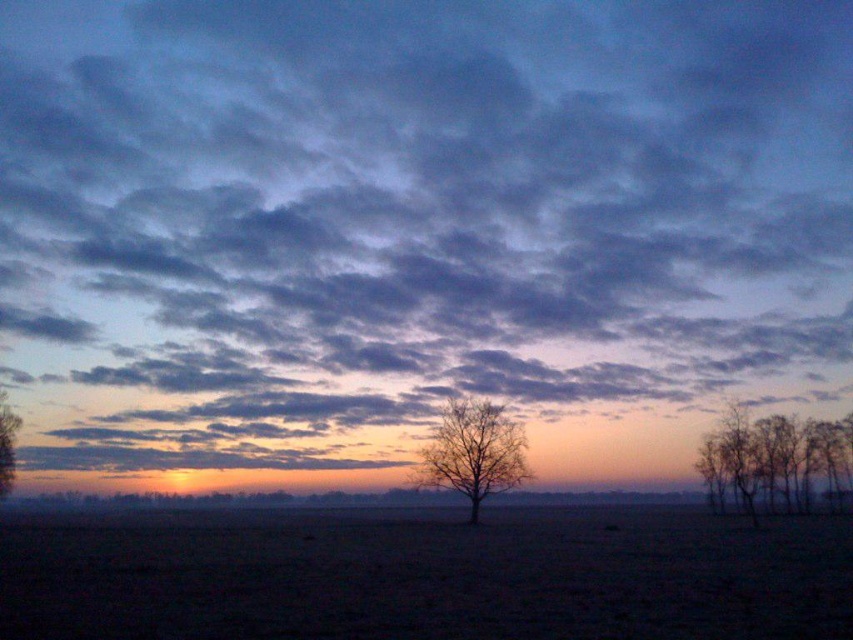
In the scene shown: Is bare branches at right closer to the viewer compared to brown matte tree at left?

That is True.

Which of these two, bare branches at right or brown matte tree at left, stands taller?

With more height is bare branches at right.

Who is more distant from viewer, (694, 467) or (15, 435)?

Point (694, 467)

Identify the location of bare branches at right. The height and width of the screenshot is (640, 853). (776, 464).

This screenshot has width=853, height=640. What do you see at coordinates (473, 452) in the screenshot? I see `bare branches at center` at bounding box center [473, 452].

Is bare branches at center bigger than brown matte tree at left?

Correct, bare branches at center is larger in size than brown matte tree at left.

Is point (485, 404) behind point (6, 410)?

That is False.

Find the location of a particular element. This screenshot has height=640, width=853. bare branches at center is located at coordinates (473, 452).

Is dark soil at center taller than bare branches at center?

Correct, dark soil at center is much taller as bare branches at center.

You are a GUI agent. You are given a task and a screenshot of the screen. Output one action in this format:
    pyautogui.click(x=<x>, y=<y>)
    Task: Click on the dark soil at center
    The width and height of the screenshot is (853, 640).
    Given the screenshot: What is the action you would take?
    pyautogui.click(x=425, y=576)

You are a GUI agent. You are given a task and a screenshot of the screen. Output one action in this format:
    pyautogui.click(x=<x>, y=<y>)
    Task: Click on the dark soil at center
    This screenshot has width=853, height=640.
    Given the screenshot: What is the action you would take?
    pyautogui.click(x=425, y=576)